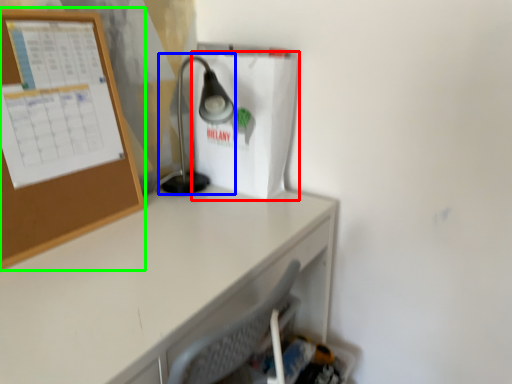
Question: Which is farther away from paper bag (highlighted by a red box)? lamp (highlighted by a blue box) or bulletin board (highlighted by a green box)?

Choices:
 (A) lamp
 (B) bulletin board

Answer: (B)